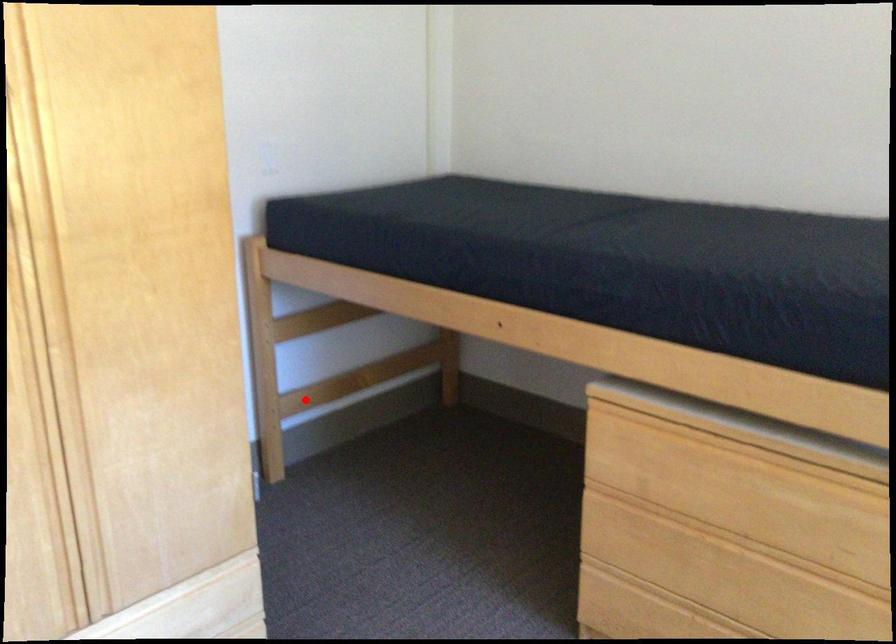
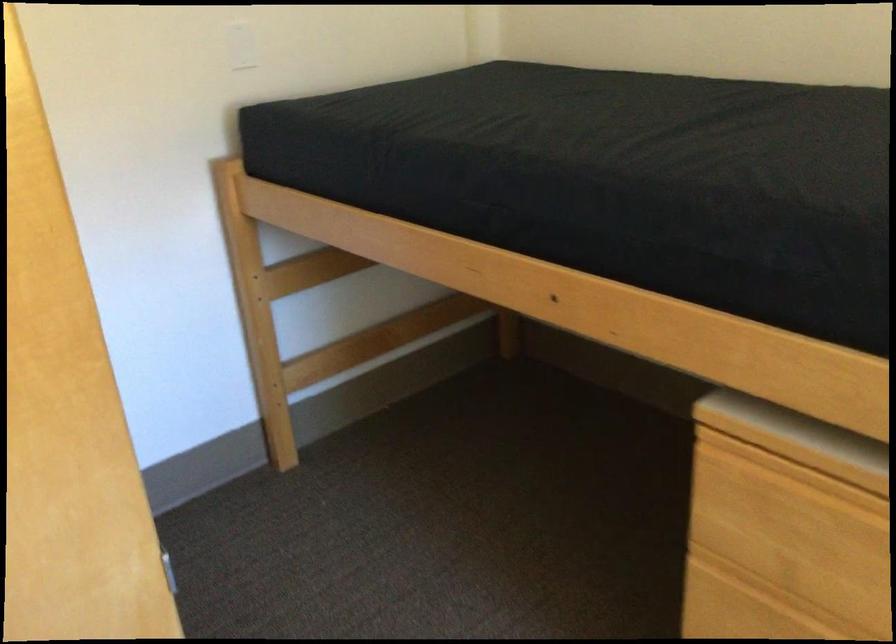
Question: A red point is marked in image1. In image2, is the corresponding 3D point closer to the camera or farther? Reply with the corresponding letter.

Choices:
 (A) The corresponding 3D point is closer.
 (B) The corresponding 3D point is farther.

Answer: (A)